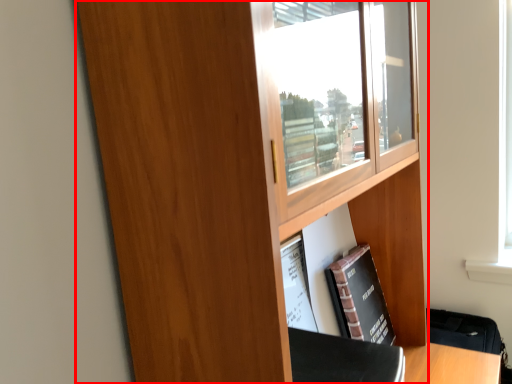
Question: From the image, what is the correct spatial relationship of cupboard (annotated by the red box) in relation to book?

Choices:
 (A) left
 (B) right

Answer: (A)